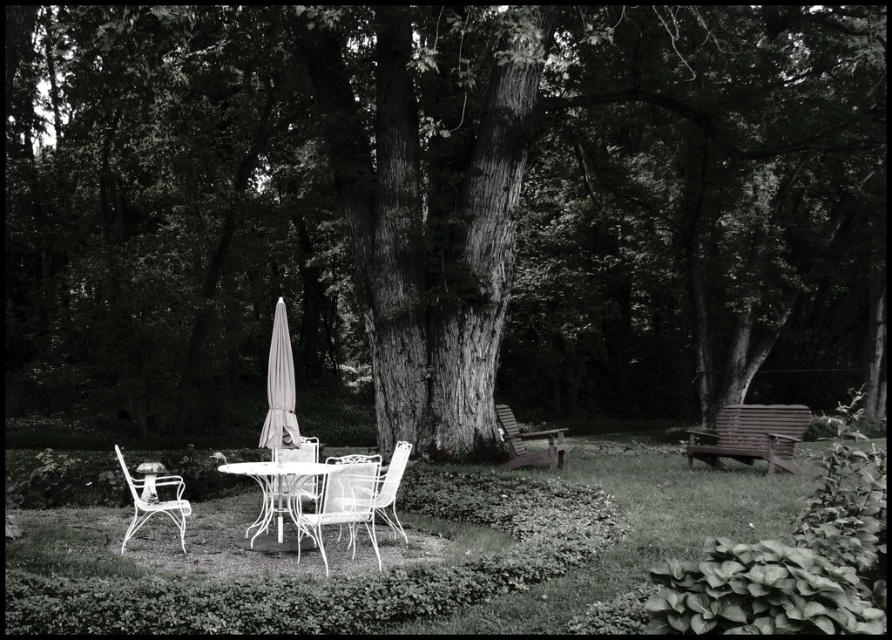
Is point (296, 528) positioned after point (539, 460)?

That is False.

Who is more distant from viewer, (332, 476) or (508, 432)?

Point (508, 432)

The width and height of the screenshot is (892, 640). I want to click on white wire chair at center, so click(x=343, y=502).

Which is in front, point (281, 524) or point (350, 456)?

Point (281, 524) is more forward.

Where is `white wrought iron chair at center`? Image resolution: width=892 pixels, height=640 pixels. white wrought iron chair at center is located at coordinates click(279, 499).

Can you confirm if white metal chair at lower left is wider than white metal chair at center?

Yes, white metal chair at lower left is wider than white metal chair at center.

Image resolution: width=892 pixels, height=640 pixels. Describe the element at coordinates (153, 497) in the screenshot. I see `white metal chair at lower left` at that location.

Where is `white metal chair at lower left`? white metal chair at lower left is located at coordinates 153,497.